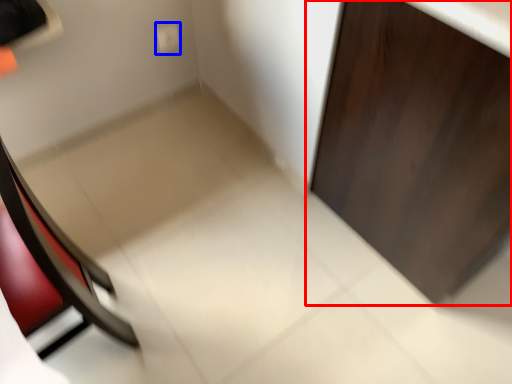
Question: Among these objects, which one is nearest to the camera, door (highlighted by a red box) or electric outlet (highlighted by a blue box)?

Choices:
 (A) door
 (B) electric outlet

Answer: (A)